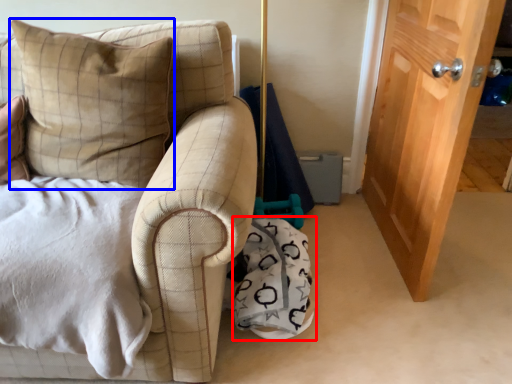
Question: Which object is closer to the camera taking this photo, material (highlighted by a red box) or pillow (highlighted by a blue box)?

Choices:
 (A) material
 (B) pillow

Answer: (B)